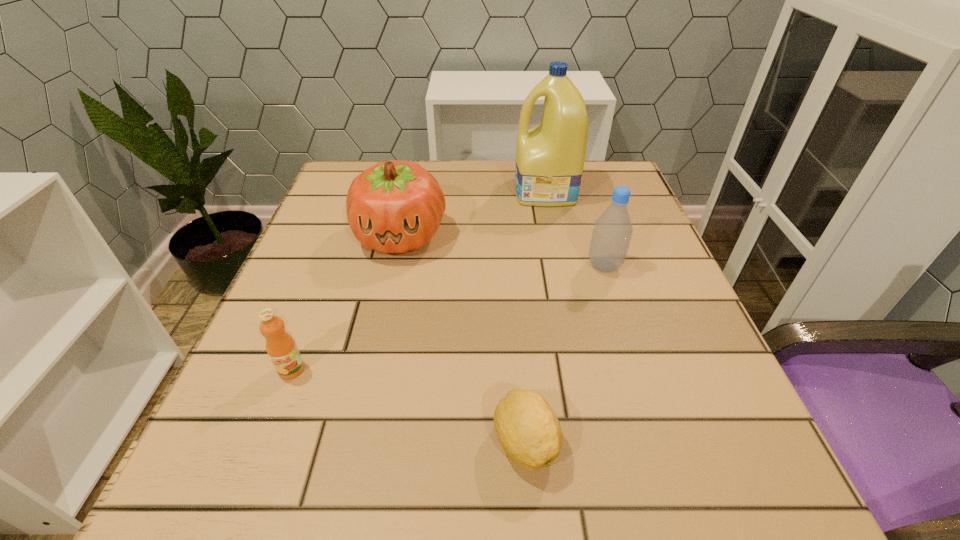
Find the location of a particular element. the farthest object is located at coordinates (550, 157).

Where is `detergent`? The image size is (960, 540). detergent is located at coordinates (550, 157).

The height and width of the screenshot is (540, 960). In order to click on the fourth object from right to left in this screenshot , I will do `click(396, 206)`.

Where is `bottle`? The width and height of the screenshot is (960, 540). bottle is located at coordinates (612, 232).

Where is `the leftmost object`? the leftmost object is located at coordinates (283, 352).

This screenshot has width=960, height=540. Find the location of `orange juice`. orange juice is located at coordinates (283, 352).

Find the location of a particular element. The height and width of the screenshot is (540, 960). the nearest object is located at coordinates (527, 428).

Locate an element on the screen. The width and height of the screenshot is (960, 540). the shortest object is located at coordinates (527, 428).

Identify the location of free spot located 0.250m on the label of the farthest object. (412, 192).

In order to click on free space located on the label of the farthest object in this screenshot , I will do `click(428, 192)`.